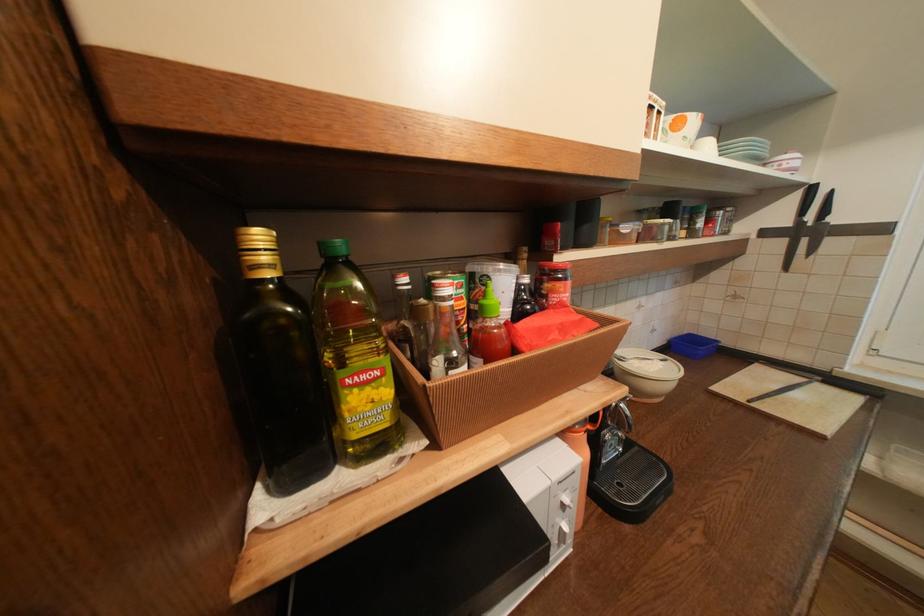
This screenshot has height=616, width=924. What do you see at coordinates (580, 458) in the screenshot?
I see `a red jar lid` at bounding box center [580, 458].